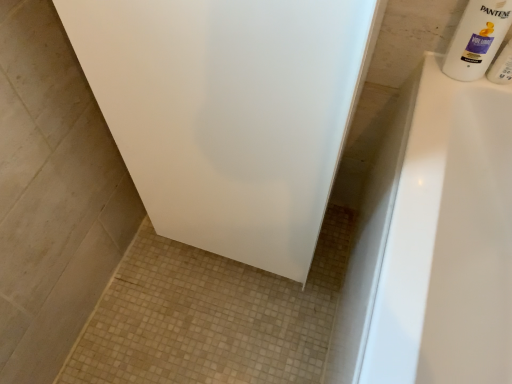
Question: Does white glossy shampoo bottle at upper right have a larger size compared to white plastic bottle at upper right?

Choices:
 (A) yes
 (B) no

Answer: (A)

Question: Does white glossy shampoo bottle at upper right have a lesser height compared to white plastic bottle at upper right?

Choices:
 (A) no
 (B) yes

Answer: (A)

Question: Is white glossy shampoo bottle at upper right next to white plastic bottle at upper right and touching it?

Choices:
 (A) yes
 (B) no

Answer: (A)

Question: From the image's perspective, is white glossy shampoo bottle at upper right beneath white plastic bottle at upper right?

Choices:
 (A) no
 (B) yes

Answer: (A)

Question: Does white glossy shampoo bottle at upper right lie in front of white plastic bottle at upper right?

Choices:
 (A) no
 (B) yes

Answer: (B)

Question: Can you confirm if white glossy shampoo bottle at upper right is positioned to the right of white plastic bottle at upper right?

Choices:
 (A) no
 (B) yes

Answer: (A)

Question: Is white plastic bottle at upper right aimed at white glossy shampoo bottle at upper right?

Choices:
 (A) no
 (B) yes

Answer: (A)

Question: From a real-world perspective, is white plastic bottle at upper right physically above white glossy shampoo bottle at upper right?

Choices:
 (A) no
 (B) yes

Answer: (A)

Question: Considering the relative positions of white plastic bottle at upper right and white glossy shampoo bottle at upper right in the image provided, is white plastic bottle at upper right to the left of white glossy shampoo bottle at upper right from the viewer's perspective?

Choices:
 (A) yes
 (B) no

Answer: (B)

Question: Can we say white plastic bottle at upper right lies outside white glossy shampoo bottle at upper right?

Choices:
 (A) yes
 (B) no

Answer: (A)

Question: Does white plastic bottle at upper right have a greater width compared to white glossy shampoo bottle at upper right?

Choices:
 (A) yes
 (B) no

Answer: (B)

Question: Is white plastic bottle at upper right at the right side of white glossy shampoo bottle at upper right?

Choices:
 (A) yes
 (B) no

Answer: (A)

Question: Is point (471, 14) positioned closer to the camera than point (502, 59)?

Choices:
 (A) closer
 (B) farther

Answer: (A)